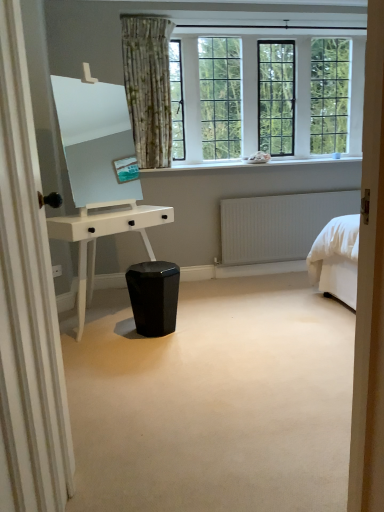
Question: Is white glossy desk at center positioned in front of clear glass windows at upper center?

Choices:
 (A) yes
 (B) no

Answer: (A)

Question: Is white glossy desk at center next to clear glass windows at upper center and touching it?

Choices:
 (A) yes
 (B) no

Answer: (B)

Question: Would you say white glossy desk at center contains clear glass windows at upper center?

Choices:
 (A) yes
 (B) no

Answer: (B)

Question: Is white glossy desk at center smaller than clear glass windows at upper center?

Choices:
 (A) no
 (B) yes

Answer: (A)

Question: Is white glossy desk at center wider than clear glass windows at upper center?

Choices:
 (A) yes
 (B) no

Answer: (A)

Question: Is white glossy desk at center facing away from clear glass windows at upper center?

Choices:
 (A) yes
 (B) no

Answer: (B)

Question: Does white smooth window sill at upper center have a larger size compared to white glossy desk at center?

Choices:
 (A) no
 (B) yes

Answer: (A)

Question: Can you confirm if white smooth window sill at upper center is positioned to the left of white glossy desk at center?

Choices:
 (A) no
 (B) yes

Answer: (A)

Question: Can you confirm if white smooth window sill at upper center is positioned to the right of white glossy desk at center?

Choices:
 (A) no
 (B) yes

Answer: (B)

Question: From the image's perspective, is white smooth window sill at upper center under white glossy desk at center?

Choices:
 (A) no
 (B) yes

Answer: (A)

Question: Would you say white smooth window sill at upper center contains white glossy desk at center?

Choices:
 (A) yes
 (B) no

Answer: (B)

Question: Is white smooth window sill at upper center thinner than white glossy desk at center?

Choices:
 (A) no
 (B) yes

Answer: (B)

Question: Does clear glass windows at upper center touch white glossy desk at center?

Choices:
 (A) no
 (B) yes

Answer: (A)